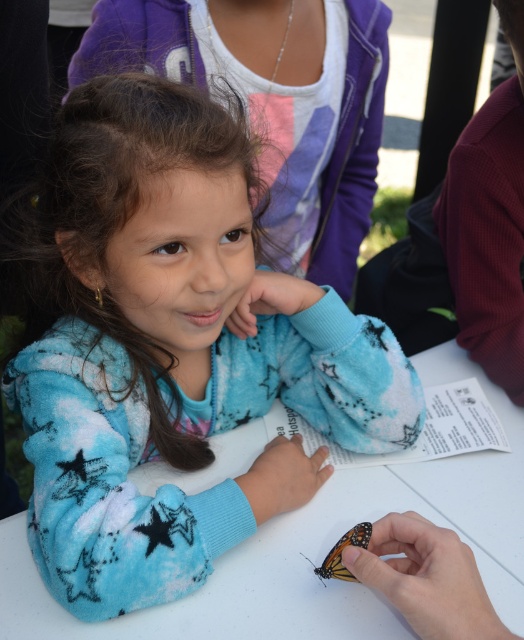
Which is behind, point (206, 552) or point (354, 531)?

Positioned behind is point (206, 552).

Is point (212, 452) less distant than point (313, 568)?

No, it is not.

Locate an element on the screen. blue fuzzy sweater at center is located at coordinates (176, 349).

Is point (274, 589) farther from camera compared to point (325, 573)?

Yes, point (274, 589) is behind point (325, 573).

Where is `white fabric table at center`? The height and width of the screenshot is (640, 524). white fabric table at center is located at coordinates click(x=320, y=547).

Where is `blue fuzzy sweater at center`? blue fuzzy sweater at center is located at coordinates (176, 349).

Which of these two, blue fuzzy sweater at center or white fabric table at center, stands taller?

With more height is blue fuzzy sweater at center.

Who is more distant from viewer, (81, 525) or (477, 464)?

Positioned behind is point (477, 464).

Find the location of a particular element. This screenshot has width=524, height=640. blue fuzzy sweater at center is located at coordinates (176, 349).